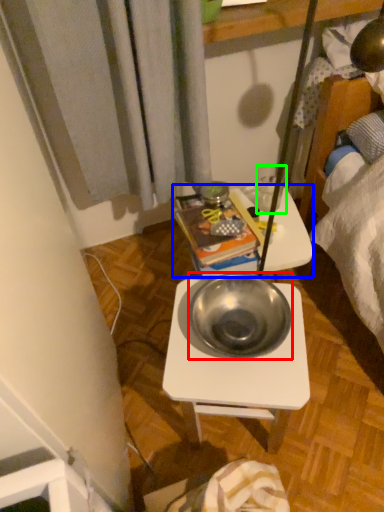
Question: Which object is the farthest from bowl (highlighted by a red box)? Choose among these: table (highlighted by a blue box) or coffee cup (highlighted by a green box).

Choices:
 (A) table
 (B) coffee cup

Answer: (B)